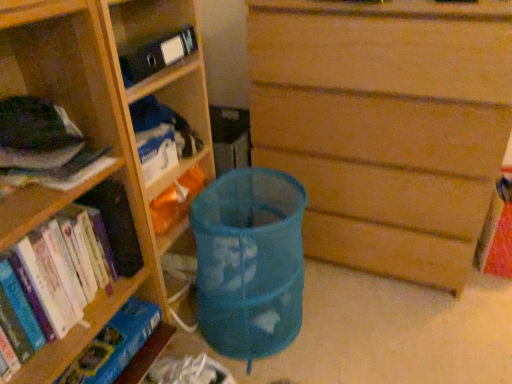
Question: Is wooden bookshelf at left, marked as the 2th shelf in a bottom-to-top arrangement, to the left or to the right of blue cardboard bookshelf at lower left, which is the first shelf from bottom to top, in the image?

Choices:
 (A) right
 (B) left

Answer: (A)

Question: In the image, is wooden bookshelf at left, marked as the 2th shelf in a bottom-to-top arrangement, positioned in front of or behind blue cardboard bookshelf at lower left, which is the first shelf from bottom to top?

Choices:
 (A) behind
 (B) front

Answer: (B)

Question: Which is farther from the blue mesh bag at center?

Choices:
 (A) wooden bookshelf at left, marked as the 2th shelf in a bottom-to-top arrangement
 (B) hardcover book at left, which is the first book from top to bottom
 (C) hardcover books at left, the 2th book when ordered from top to bottom
 (D) blue cardboard bookshelf at lower left, marked as the 2th shelf in a top-to-bottom arrangement
 (E) wooden chest of drawers at center

Answer: (B)

Question: Which object is positioned closest to the wooden chest of drawers at center?

Choices:
 (A) blue mesh bag at center
 (B) hardcover books at left, the 1th book ordered from the bottom
 (C) wooden bookshelf at left, marked as the 2th shelf in a bottom-to-top arrangement
 (D) blue cardboard bookshelf at lower left, marked as the 2th shelf in a top-to-bottom arrangement
 (E) hardcover book at left, placed as the second book when sorted from bottom to top

Answer: (A)